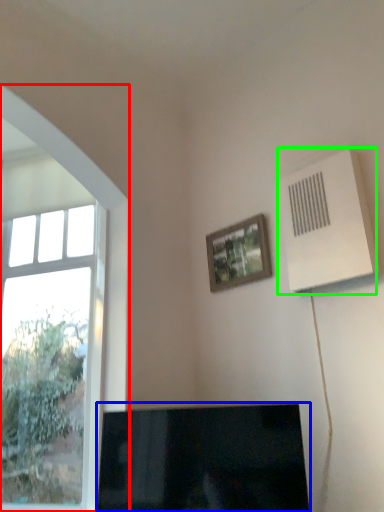
Question: Based on their relative distances, which object is nearer to window (highlighted by a red box)? Choose from television (highlighted by a blue box) and air conditioning (highlighted by a green box).

Choices:
 (A) television
 (B) air conditioning

Answer: (A)